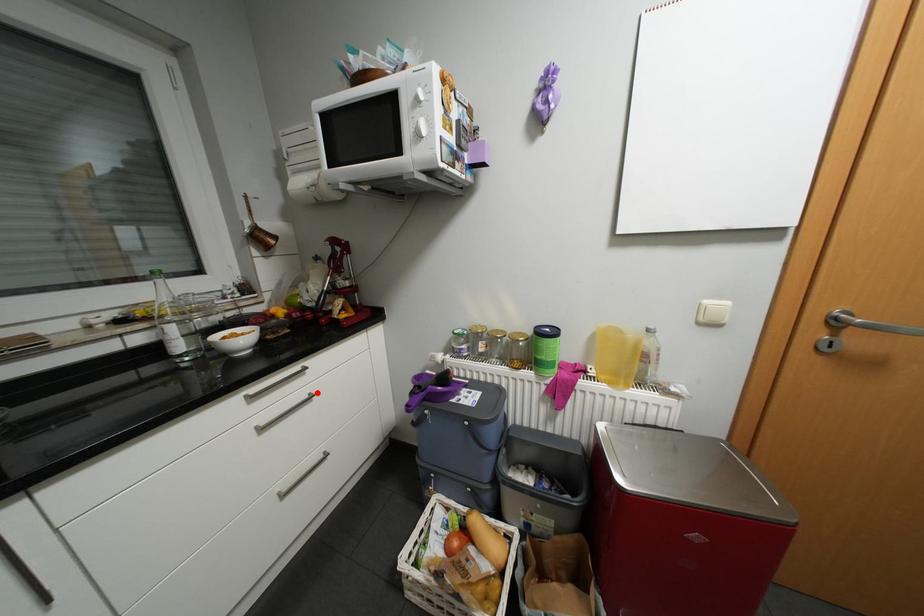
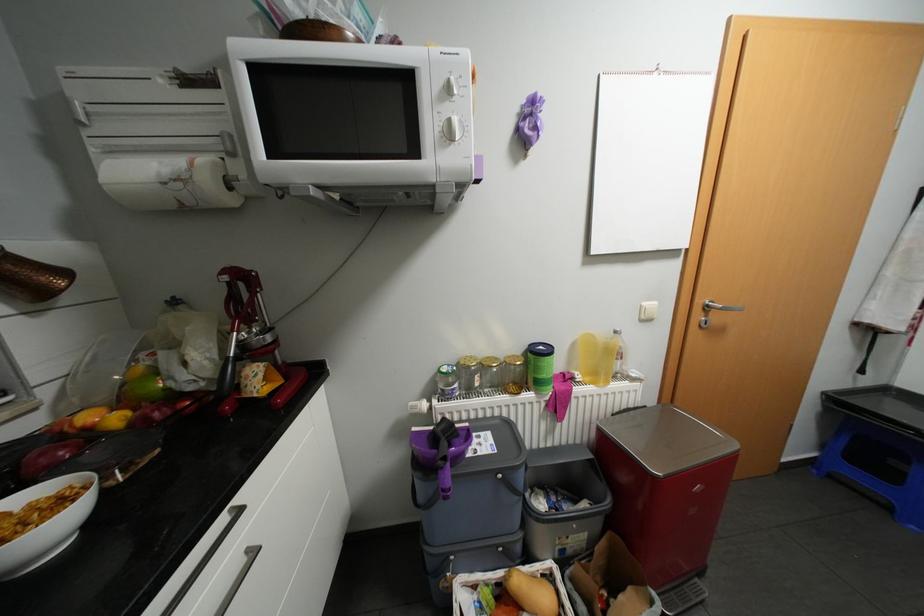
Question: A red point is marked in image1. In image2, is the corresponding 3D point closer to the camera or farther? Reply with the corresponding letter.

Choices:
 (A) The corresponding 3D point is closer.
 (B) The corresponding 3D point is farther.

Answer: (B)